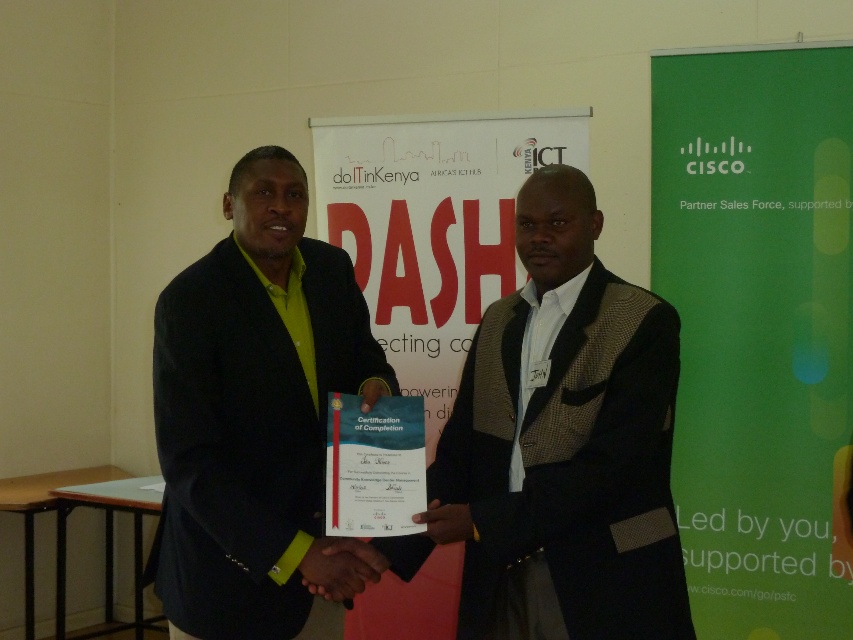
Question: From the image, what is the correct spatial relationship of dark brown textured blazer at center in relation to matte black suit at center?

Choices:
 (A) left
 (B) right

Answer: (B)

Question: Is dark brown textured blazer at center further to the viewer compared to matte black suit at center?

Choices:
 (A) no
 (B) yes

Answer: (A)

Question: Which point is closer to the camera?

Choices:
 (A) (219, 266)
 (B) (566, 509)

Answer: (B)

Question: Among these points, which one is nearest to the camera?

Choices:
 (A) (184, 440)
 (B) (515, 241)

Answer: (A)

Question: Which object appears closest to the camera in this image?

Choices:
 (A) dark brown textured blazer at center
 (B) matte black suit at center

Answer: (A)

Question: Does dark brown textured blazer at center come in front of matte black suit at center?

Choices:
 (A) yes
 (B) no

Answer: (A)